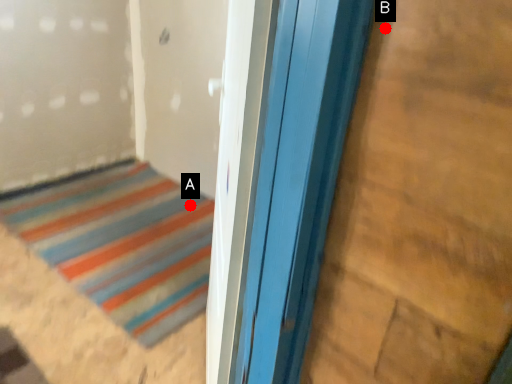
Question: Two points are circled on the image, labeled by A and B beside each circle. Among these points, which one is farthest from the camera?

Choices:
 (A) A is further
 (B) B is further

Answer: (A)